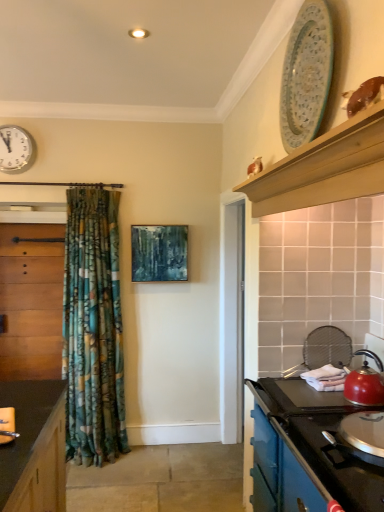
Find the location of a particular element. The width and height of the screenshot is (384, 512). matte black sink at lower left is located at coordinates (7, 425).

What is the approximate width of matte red kettle at right?

matte red kettle at right is 8.75 inches wide.

The image size is (384, 512). Find the location of `teal matte painting at center`. teal matte painting at center is located at coordinates (159, 253).

Find the location of a particular element. The image size is (384, 512). porcelain plate at upper right is located at coordinates (306, 75).

From the picture: From their relative heights in the image, would you say matte red kettle at right is taller or shorter than matte black sink at lower left?

In the image, matte red kettle at right appears to be taller than matte black sink at lower left.

Is matte red kettle at right positioned beyond the bounds of matte black sink at lower left?

Yes, matte red kettle at right is not within matte black sink at lower left.

Identify the location of sink beneath the matte red kettle at right (from a real-world perspective). (7, 425).

Visually, is matte red kettle at right positioned to the left or to the right of matte black sink at lower left?

Based on their positions, matte red kettle at right is located to the right of matte black sink at lower left.

Which is closer to the camera, [15,434] or [8,129]?

The point [15,434] is closer to the camera.

Based on the photo, would you say white glossy clock at upper left is part of matte black sink at lower left's contents?

No, white glossy clock at upper left is not a part of matte black sink at lower left.

Looking at this image, from a real-world perspective, who is located lower, matte black sink at lower left or white glossy clock at upper left?

matte black sink at lower left is physically lower.

Looking at this image, is matte black sink at lower left beside white glossy clock at upper left?

No, matte black sink at lower left is not touching white glossy clock at upper left.

Is white glossy clock at upper left turned away from blue enamel stove at lower right, the first cabinetry positioned from the front?

No, white glossy clock at upper left's orientation is not away from blue enamel stove at lower right, the first cabinetry positioned from the front.

From the image's perspective, does white glossy clock at upper left appear lower than blue enamel stove at lower right, placed as the second cabinetry when sorted from back to front?

Actually, white glossy clock at upper left appears above blue enamel stove at lower right, placed as the second cabinetry when sorted from back to front, in the image.

Is point (25, 141) positioned after point (349, 476)?

Yes, point (25, 141) is farther from viewer.

Can you confirm if white glossy clock at upper left is bigger than blue enamel stove at lower right, the first cabinetry positioned from the front?

No.

Is blue enamel stove at lower right, the first cabinetry from the right, positioned beyond the bounds of matte black sink at lower left?

blue enamel stove at lower right, the first cabinetry from the right, is positioned outside matte black sink at lower left.

Does blue enamel stove at lower right, placed as the second cabinetry when sorted from back to front, have a smaller size compared to matte black sink at lower left?

No, blue enamel stove at lower right, placed as the second cabinetry when sorted from back to front, is not smaller than matte black sink at lower left.

Considering the relative sizes of blue enamel stove at lower right, placed as the second cabinetry when sorted from back to front, and matte black sink at lower left in the image provided, is blue enamel stove at lower right, placed as the second cabinetry when sorted from back to front, taller than matte black sink at lower left?

Indeed, blue enamel stove at lower right, placed as the second cabinetry when sorted from back to front, has a greater height compared to matte black sink at lower left.

Is blue enamel stove at lower right, placed as the second cabinetry when sorted from back to front, thinner than matte black sink at lower left?

In fact, blue enamel stove at lower right, placed as the second cabinetry when sorted from back to front, might be wider than matte black sink at lower left.

From a real-world perspective, relative to white glossy clock at upper left, is wooden plate at upper right vertically above or below?

In terms of real-world spatial position, wooden plate at upper right is below white glossy clock at upper left.

Is wooden plate at upper right smaller than white glossy clock at upper left?

Incorrect, wooden plate at upper right is not smaller in size than white glossy clock at upper left.

Can you confirm if wooden plate at upper right is positioned to the right of white glossy clock at upper left?

Indeed, wooden plate at upper right is positioned on the right side of white glossy clock at upper left.

From a real-world perspective, is wooden plate at upper right located higher than matte black sink at lower left?

Yes.

Does wooden plate at upper right have a greater width compared to matte black sink at lower left?

Incorrect, the width of wooden plate at upper right does not surpass that of matte black sink at lower left.

Is wooden plate at upper right taller or shorter than matte black sink at lower left?

In the image, wooden plate at upper right appears to be taller than matte black sink at lower left.

Are matte black sink at lower left and porcelain plate at upper right making contact?

matte black sink at lower left is not next to porcelain plate at upper right, and they're not touching.

Is matte black sink at lower left closer to the viewer compared to porcelain plate at upper right?

That is False.

Considering the points (5, 434) and (327, 84), which point is behind, point (5, 434) or point (327, 84)?

The point (5, 434) is farther from the camera.

Is matte black sink at lower left looking in the opposite direction of porcelain plate at upper right?

No, matte black sink at lower left is not facing away from porcelain plate at upper right.

In order to click on sink on the left of matte red kettle at right in this screenshot , I will do `click(7, 425)`.

At what (x,y) coordinates should I click in order to perform the action: click on sink below the white glossy clock at upper left (from the image's perspective). Please return your answer as a coordinate pair (x, y). The width and height of the screenshot is (384, 512). Looking at the image, I should click on (7, 425).

Looking at the image, which one is located closer to matte black sink at lower left, white glossy clock at upper left or wooden cabinet at left, acting as the 2th cabinetry starting from the front?

wooden cabinet at left, acting as the 2th cabinetry starting from the front, is closer to matte black sink at lower left.

When comparing their distances from blue enamel stove at lower right, placed as the second cabinetry when sorted from back to front, does matte red kettle at right or white glossy clock at upper left seem closer?

matte red kettle at right.

When comparing their distances from matte red kettle at right, does wooden cabinet at left, the first cabinetry in the back-to-front sequence, or matte black sink at lower left seem further?

wooden cabinet at left, the first cabinetry in the back-to-front sequence, lies further to matte red kettle at right than the other object.

Considering their positions, is teal matte painting at center positioned closer to wooden plate at upper right than white glossy clock at upper left?

teal matte painting at center.

Considering their positions, is matte red kettle at right positioned further to porcelain plate at upper right than teal matte painting at center?

teal matte painting at center lies further to porcelain plate at upper right than the other object.

When comparing their distances from matte black sink at lower left, does wooden cabinet at left, the first cabinetry in the back-to-front sequence, or white glossy clock at upper left seem further?

white glossy clock at upper left lies further to matte black sink at lower left than the other object.

Estimate the real-world distances between objects in this image. Which object is further from matte black sink at lower left, blue enamel stove at lower right, the first cabinetry positioned from the front, or matte red kettle at right?

Based on the image, matte red kettle at right appears to be further to matte black sink at lower left.

Looking at the image, which one is located further to matte black sink at lower left, wooden cabinet at left, acting as the 2th cabinetry starting from the front, or teal matte painting at center?

wooden cabinet at left, acting as the 2th cabinetry starting from the front, lies further to matte black sink at lower left than the other object.

Image resolution: width=384 pixels, height=512 pixels. I want to click on cabinetry between white glossy clock at upper left and matte red kettle at right, so click(x=306, y=452).

At what (x,y) coordinates should I click in order to perform the action: click on sink located between wooden plate at upper right and white glossy clock at upper left in the depth direction. Please return your answer as a coordinate pair (x, y). This screenshot has width=384, height=512. Looking at the image, I should click on (7, 425).

This screenshot has height=512, width=384. Find the location of `kettle between porcelain plate at upper right and blue enamel stove at lower right, the 2th cabinetry when ordered from left to right, from top to bottom`. kettle between porcelain plate at upper right and blue enamel stove at lower right, the 2th cabinetry when ordered from left to right, from top to bottom is located at coordinates (364, 387).

Where is `appliance between white glossy clock at upper left and blue enamel stove at lower right, the first cabinetry positioned from the front`? The height and width of the screenshot is (512, 384). appliance between white glossy clock at upper left and blue enamel stove at lower right, the first cabinetry positioned from the front is located at coordinates (306, 75).